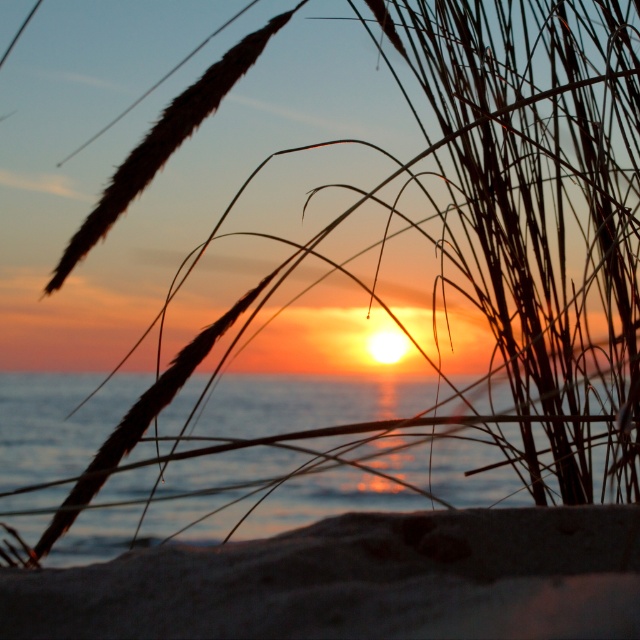
Question: Does dark brown sandy beach at lower center appear under translucent water at center?

Choices:
 (A) no
 (B) yes

Answer: (A)

Question: Can you confirm if dark brown sandy beach at lower center is positioned below translucent water at center?

Choices:
 (A) yes
 (B) no

Answer: (B)

Question: Among these objects, which one is nearest to the camera?

Choices:
 (A) dark brown sandy beach at lower center
 (B) translucent water at center

Answer: (A)

Question: From the image, what is the correct spatial relationship of dark brown sandy beach at lower center in relation to translucent water at center?

Choices:
 (A) below
 (B) above

Answer: (B)

Question: Among these objects, which one is nearest to the camera?

Choices:
 (A) translucent water at center
 (B) dark brown sandy beach at lower center

Answer: (B)